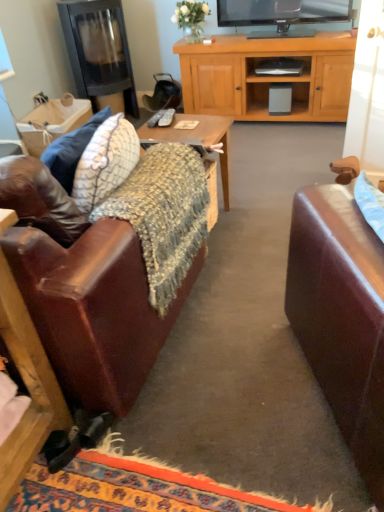
Question: From the image's perspective, is matte gray remote control at center, marked as the 2th remote control in a left-to-right arrangement, on top of knitted woolen blanket at center?

Choices:
 (A) no
 (B) yes

Answer: (B)

Question: Is matte gray remote control at center, marked as the first remote control in a right-to-left arrangement, facing towards knitted woolen blanket at center?

Choices:
 (A) no
 (B) yes

Answer: (A)

Question: Considering the relative positions of matte gray remote control at center, marked as the 2th remote control in a left-to-right arrangement, and knitted woolen blanket at center in the image provided, is matte gray remote control at center, marked as the 2th remote control in a left-to-right arrangement, to the left of knitted woolen blanket at center from the viewer's perspective?

Choices:
 (A) yes
 (B) no

Answer: (B)

Question: Is matte gray remote control at center, marked as the 2th remote control in a left-to-right arrangement, to the right of knitted woolen blanket at center from the viewer's perspective?

Choices:
 (A) no
 (B) yes

Answer: (B)

Question: Does matte gray remote control at center, marked as the first remote control in a right-to-left arrangement, come in front of knitted woolen blanket at center?

Choices:
 (A) no
 (B) yes

Answer: (A)

Question: Is knitted woolen blanket at center a part of matte gray remote control at center, marked as the first remote control in a right-to-left arrangement?

Choices:
 (A) yes
 (B) no

Answer: (B)

Question: Is black glass fireplace at upper left positioned in front of knitted fabric desk at center?

Choices:
 (A) yes
 (B) no

Answer: (B)

Question: From the image's perspective, is black glass fireplace at upper left located beneath knitted fabric desk at center?

Choices:
 (A) yes
 (B) no

Answer: (B)

Question: Would you say black glass fireplace at upper left is outside knitted fabric desk at center?

Choices:
 (A) yes
 (B) no

Answer: (A)

Question: Is black glass fireplace at upper left at the left side of knitted fabric desk at center?

Choices:
 (A) yes
 (B) no

Answer: (A)

Question: Is black glass fireplace at upper left oriented away from knitted fabric desk at center?

Choices:
 (A) yes
 (B) no

Answer: (B)

Question: Does black glass fireplace at upper left contain knitted fabric desk at center?

Choices:
 (A) no
 (B) yes

Answer: (A)

Question: Is the position of black glass fireplace at upper left less distant than that of leather couch at left?

Choices:
 (A) no
 (B) yes

Answer: (A)